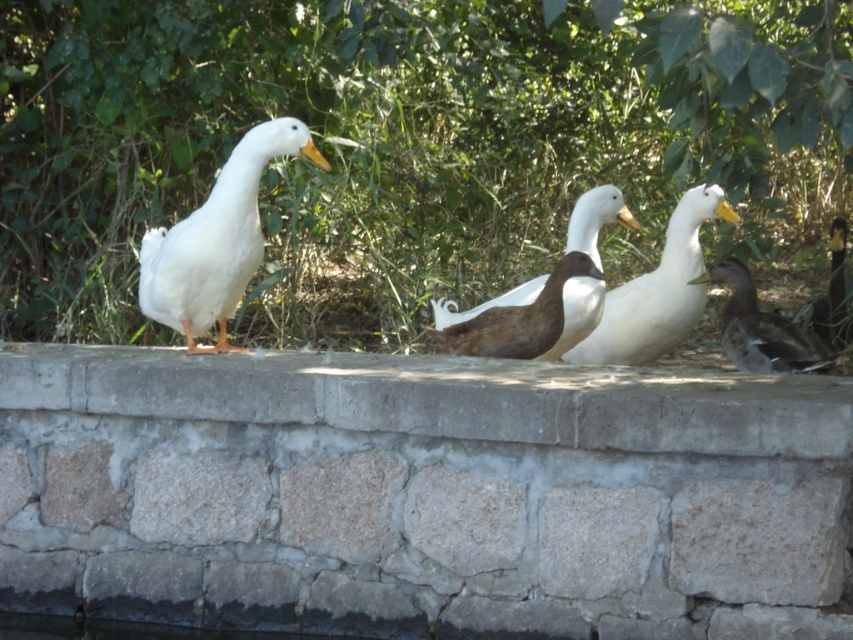
Question: Can you confirm if gray stone ledge at center is positioned below brown matte duck at center?

Choices:
 (A) no
 (B) yes

Answer: (B)

Question: Based on their relative distances, which object is nearer to the brown matte duck at lower right?

Choices:
 (A) brown matte duck at center
 (B) gray stone ledge at center
 (C) white matte duck at center
 (D) brown matte goose at center

Answer: (C)

Question: Does white matte duck at center appear under brown matte duck at lower right?

Choices:
 (A) no
 (B) yes

Answer: (A)

Question: Can you confirm if white matte duck at left is wider than brown matte duck at lower right?

Choices:
 (A) yes
 (B) no

Answer: (A)

Question: Among these objects, which one is farthest from the camera?

Choices:
 (A) brown matte duck at right
 (B) white matte duck at left
 (C) white matte duck at center
 (D) gray stone ledge at center

Answer: (A)

Question: Which is nearer to the brown matte duck at lower right?

Choices:
 (A) brown matte goose at center
 (B) brown matte duck at center
 (C) gray stone ledge at center
 (D) white matte duck at center

Answer: (D)